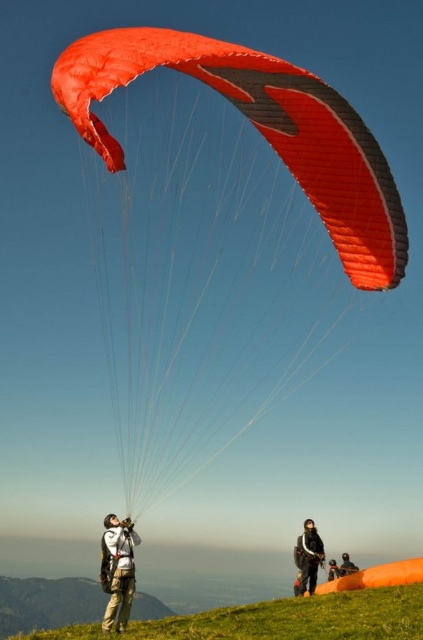
Question: Among these objects, which one is nearest to the camera?

Choices:
 (A) orange matte parachute at upper center
 (B) black matte helmet at upper center

Answer: (A)

Question: From the image, what is the correct spatial relationship of white fabric parachute at upper center in relation to black fabric jacket at lower center?

Choices:
 (A) below
 (B) above

Answer: (B)

Question: Which object appears closest to the camera in this image?

Choices:
 (A) black fabric jacket at lower center
 (B) white fabric parachute at upper center
 (C) orange matte parachute at upper center
 (D) orange fabric parachute at upper center

Answer: (C)

Question: Is orange matte parachute at upper center below black fabric jacket at lower center?

Choices:
 (A) yes
 (B) no

Answer: (B)

Question: Which point is closer to the camera?

Choices:
 (A) (123, 544)
 (B) (351, 566)
 (C) (104, 157)
 (D) (332, 572)

Answer: (C)

Question: Can you confirm if white fabric parachute at upper center is wider than black matte helmet at upper center?

Choices:
 (A) no
 (B) yes

Answer: (B)